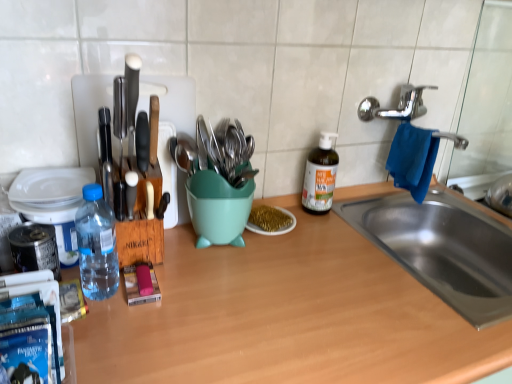
Where is `spots to the right of teal plastic mixing bowl at center`? The height and width of the screenshot is (384, 512). spots to the right of teal plastic mixing bowl at center is located at coordinates (x=298, y=260).